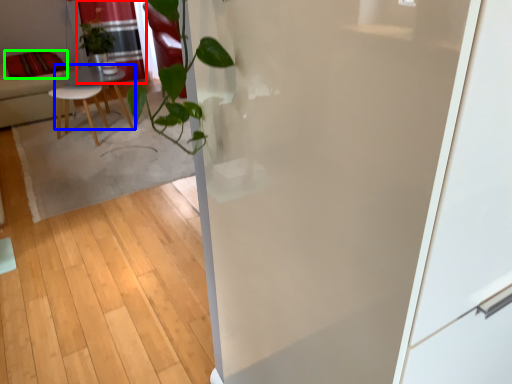
Question: Considering the real-world distances, which object is closest to curtain (highlighted by a red box)? table (highlighted by a blue box) or pillow (highlighted by a green box).

Choices:
 (A) table
 (B) pillow

Answer: (A)